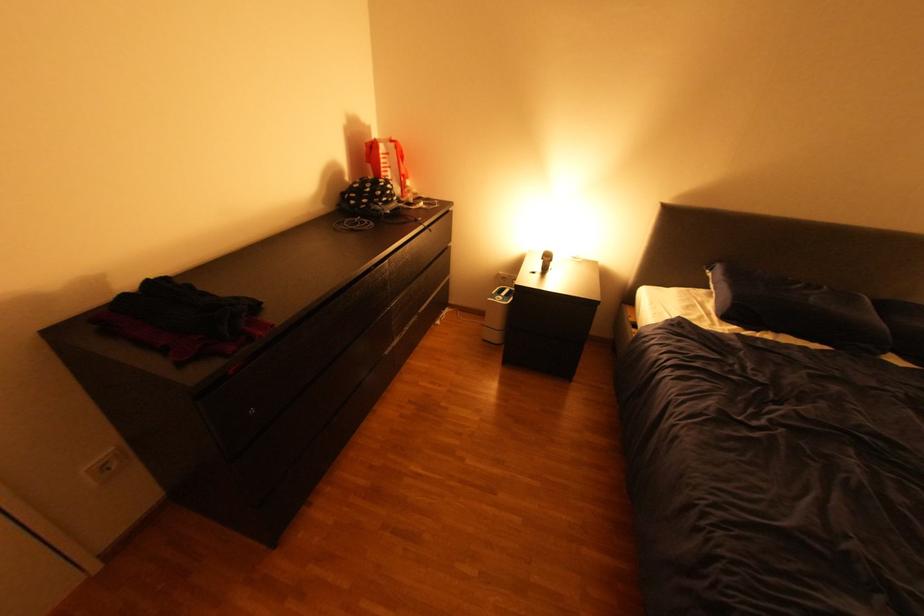
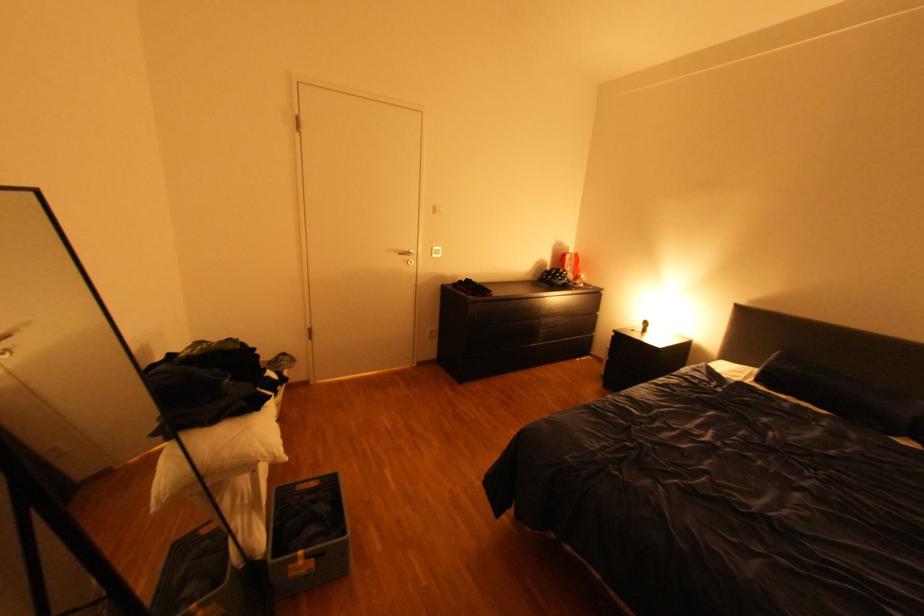
Where in the second image is the point corresponding to the point at 396,353 from the first image?

(542, 345)